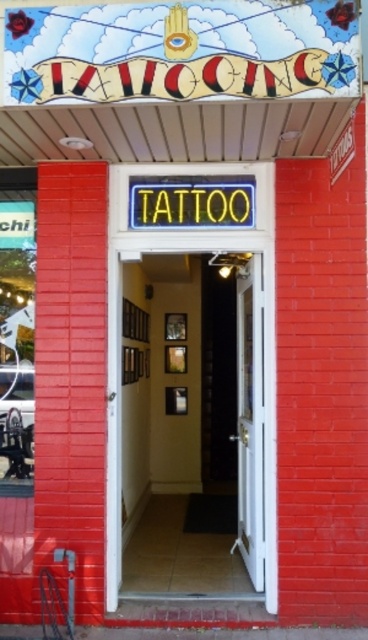
Based on the photo, is white glossy door at center shorter than white wooden door at center?

Incorrect, white glossy door at center's height does not fall short of white wooden door at center's.

Can you confirm if white glossy door at center is thinner than white wooden door at center?

No.

Does point (174, 508) come closer to viewer compared to point (239, 536)?

No, (174, 508) is behind (239, 536).

What are the coordinates of `white glossy door at center` in the screenshot? It's located at (192, 428).